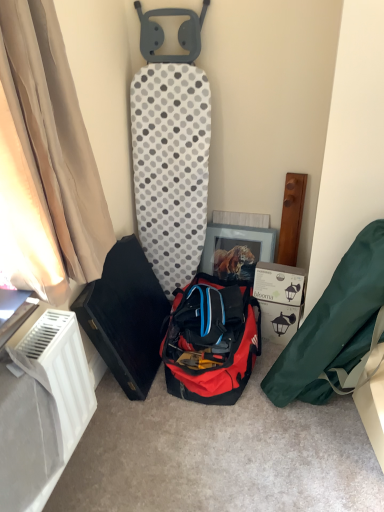
Question: Would you say green fabric bag at lower right, the first kit in the right-to-left sequence, is part of white cardboard box at lower right's contents?

Choices:
 (A) yes
 (B) no

Answer: (B)

Question: Is white cardboard box at lower right taller than green fabric bag at lower right, the first kit in the right-to-left sequence?

Choices:
 (A) yes
 (B) no

Answer: (B)

Question: From a real-world perspective, does white cardboard box at lower right stand above green fabric bag at lower right, arranged as the 2th kit when viewed from the left?

Choices:
 (A) yes
 (B) no

Answer: (B)

Question: Is white cardboard box at lower right bigger than green fabric bag at lower right, the first kit in the right-to-left sequence?

Choices:
 (A) yes
 (B) no

Answer: (B)

Question: Does white cardboard box at lower right have a greater width compared to green fabric bag at lower right, arranged as the 2th kit when viewed from the left?

Choices:
 (A) yes
 (B) no

Answer: (A)

Question: Does point (31, 126) appear closer or farther from the camera than point (319, 352)?

Choices:
 (A) closer
 (B) farther

Answer: (A)

Question: From their relative heights in the image, would you say beige fabric curtain at left is taller or shorter than green fabric bag at lower right, arranged as the 2th kit when viewed from the left?

Choices:
 (A) short
 (B) tall

Answer: (A)

Question: Relative to green fabric bag at lower right, arranged as the 2th kit when viewed from the left, is beige fabric curtain at left in front or behind?

Choices:
 (A) behind
 (B) front

Answer: (B)

Question: From a real-world perspective, relative to green fabric bag at lower right, the first kit in the right-to-left sequence, is beige fabric curtain at left vertically above or below?

Choices:
 (A) above
 (B) below

Answer: (A)

Question: Relative to white plastic radiator at lower left, is green fabric bag at lower right, the first kit in the right-to-left sequence, in front or behind?

Choices:
 (A) behind
 (B) front

Answer: (A)

Question: Considering the positions of green fabric bag at lower right, arranged as the 2th kit when viewed from the left, and white plastic radiator at lower left in the image, is green fabric bag at lower right, arranged as the 2th kit when viewed from the left, bigger or smaller than white plastic radiator at lower left?

Choices:
 (A) big
 (B) small

Answer: (A)

Question: Is point (291, 378) positioned closer to the camera than point (43, 365)?

Choices:
 (A) closer
 (B) farther

Answer: (B)

Question: Considering the positions of green fabric bag at lower right, the first kit in the right-to-left sequence, and white plastic radiator at lower left in the image, is green fabric bag at lower right, the first kit in the right-to-left sequence, wider or thinner than white plastic radiator at lower left?

Choices:
 (A) wide
 (B) thin

Answer: (A)

Question: Considering the relative positions of black hard case at left, which ranks as the 1th kit in left-to-right order, and red fabric duffel bag at center in the image provided, is black hard case at left, which ranks as the 1th kit in left-to-right order, to the left or to the right of red fabric duffel bag at center?

Choices:
 (A) right
 (B) left

Answer: (B)

Question: In the image, is black hard case at left, which ranks as the 1th kit in left-to-right order, positioned in front of or behind red fabric duffel bag at center?

Choices:
 (A) front
 (B) behind

Answer: (A)